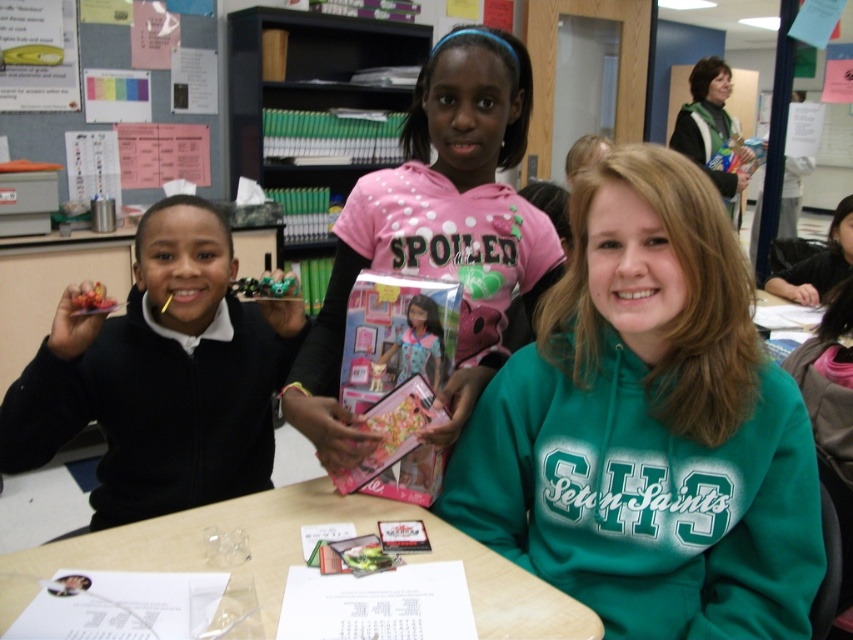
Is wooden table at center above metallic green toy car at center?

Actually, wooden table at center is below metallic green toy car at center.

Looking at this image, which of these two, wooden table at center or metallic green toy car at center, stands taller?

With more height is wooden table at center.

Is point (97, 552) closer to viewer compared to point (244, 292)?

That is True.

At what (x,y) coordinates should I click in order to perform the action: click on wooden table at center. Please return your answer as a coordinate pair (x, y). The height and width of the screenshot is (640, 853). Looking at the image, I should click on (303, 561).

Who is more forward, (190,456) or (80,90)?

Point (190,456) is in front.

What do you see at coordinates (161, 376) in the screenshot?
I see `matte black toy car at left` at bounding box center [161, 376].

Where is `matte black toy car at left`? This screenshot has width=853, height=640. matte black toy car at left is located at coordinates (161, 376).

Which is below, matte pink paper at upper left or metallic green toy car at center?

metallic green toy car at center

In the scene shown: How much distance is there between matte pink paper at upper left and metallic green toy car at center?

matte pink paper at upper left and metallic green toy car at center are 6.99 feet apart.

At what (x,y) coordinates should I click in order to perform the action: click on matte pink paper at upper left. Please return your answer as a coordinate pair (x, y). Image resolution: width=853 pixels, height=640 pixels. Looking at the image, I should click on (67, 112).

Identify the location of matte pink paper at upper left. The height and width of the screenshot is (640, 853). (67, 112).